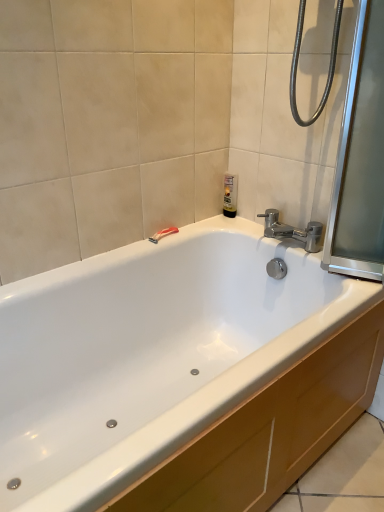
Question: From the image's perspective, is polished chrome faucet at upper right located above or below translucent plastic bottle at upper center?

Choices:
 (A) below
 (B) above

Answer: (A)

Question: Is polished chrome faucet at upper right taller or shorter than translucent plastic bottle at upper center?

Choices:
 (A) tall
 (B) short

Answer: (B)

Question: Which of these objects is positioned farthest from the red plastic razor at upper center?

Choices:
 (A) transparent glass screen door at right
 (B) translucent plastic bottle at upper center
 (C) polished chrome faucet at upper right

Answer: (A)

Question: Estimate the real-world distances between objects in this image. Which object is closer to the red plastic razor at upper center?

Choices:
 (A) polished chrome faucet at upper right
 (B) transparent glass screen door at right
 (C) translucent plastic bottle at upper center

Answer: (C)